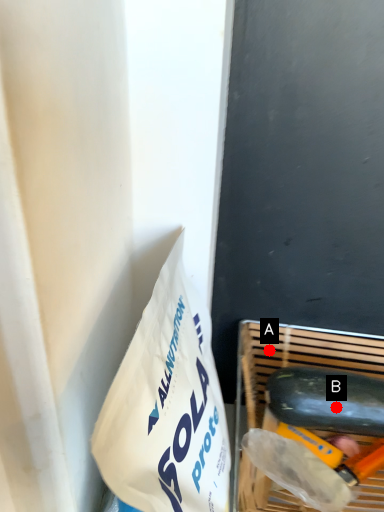
Question: Two points are circled on the image, labeled by A and B beside each circle. Among these points, which one is farthest from the camera?

Choices:
 (A) A is further
 (B) B is further

Answer: (A)